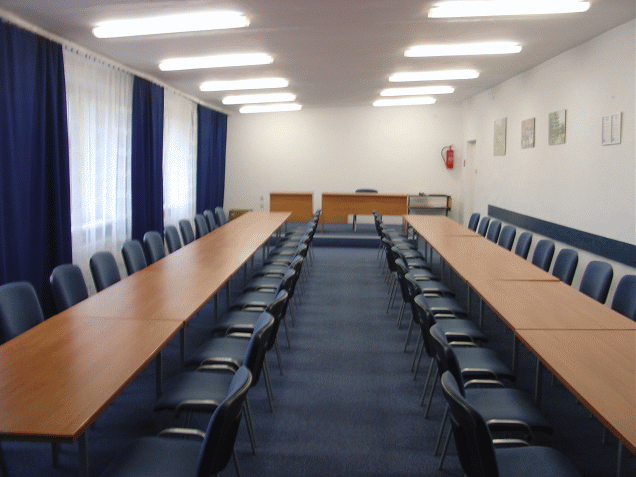
Find the location of `blue curtains`. blue curtains is located at coordinates (32, 183), (151, 174), (221, 159).